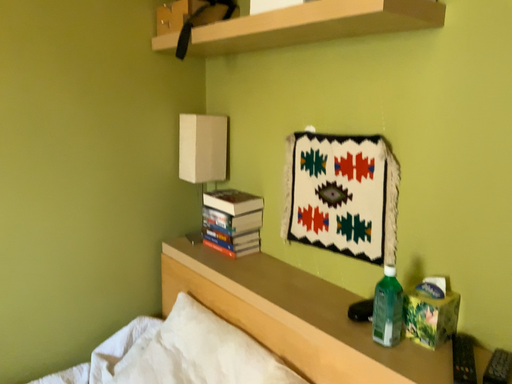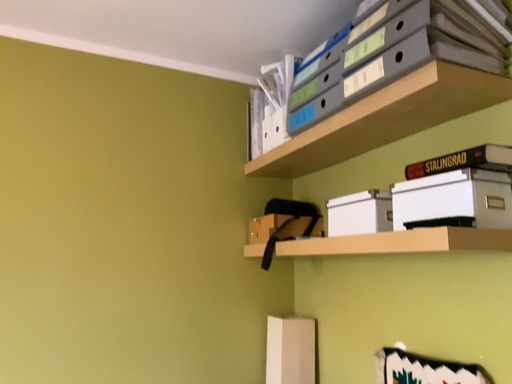
Question: How did the camera likely rotate when shooting the video?

Choices:
 (A) rotated right
 (B) rotated left

Answer: (B)